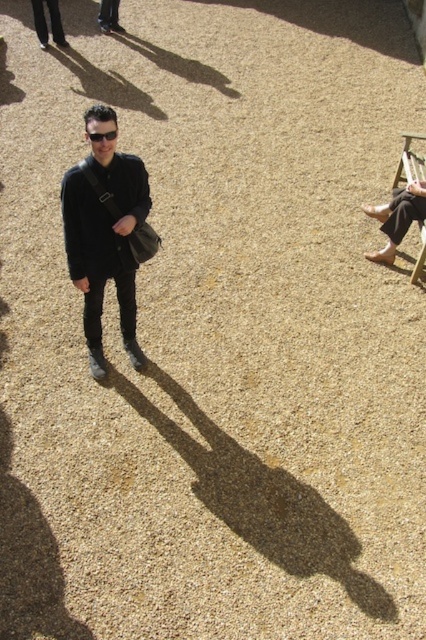
Question: Estimate the real-world distances between objects in this image. Which object is closer to the black matte sunglasses at center?

Choices:
 (A) wooden at right
 (B) matte black jacket at center

Answer: (B)

Question: Among these points, which one is farthest from the camera?

Choices:
 (A) (75, 209)
 (B) (408, 138)
 (C) (92, 140)

Answer: (B)

Question: Can you confirm if wooden at right is wider than black matte sunglasses at center?

Choices:
 (A) no
 (B) yes

Answer: (B)

Question: Which point appears closest to the camera in this image?

Choices:
 (A) (114, 154)
 (B) (112, 132)
 (C) (420, 172)

Answer: (B)

Question: Can you confirm if wooden at right is positioned above black matte sunglasses at center?

Choices:
 (A) yes
 (B) no

Answer: (A)

Question: Is matte black jacket at center smaller than black matte sunglasses at center?

Choices:
 (A) yes
 (B) no

Answer: (B)